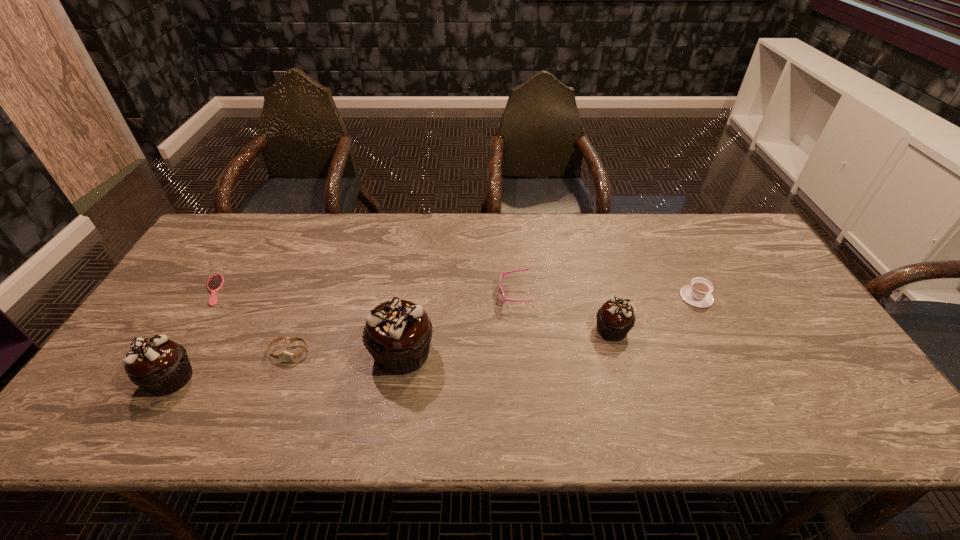
I want to click on free point that keeps the cupcakes evenly spaced on the right, so click(x=804, y=309).